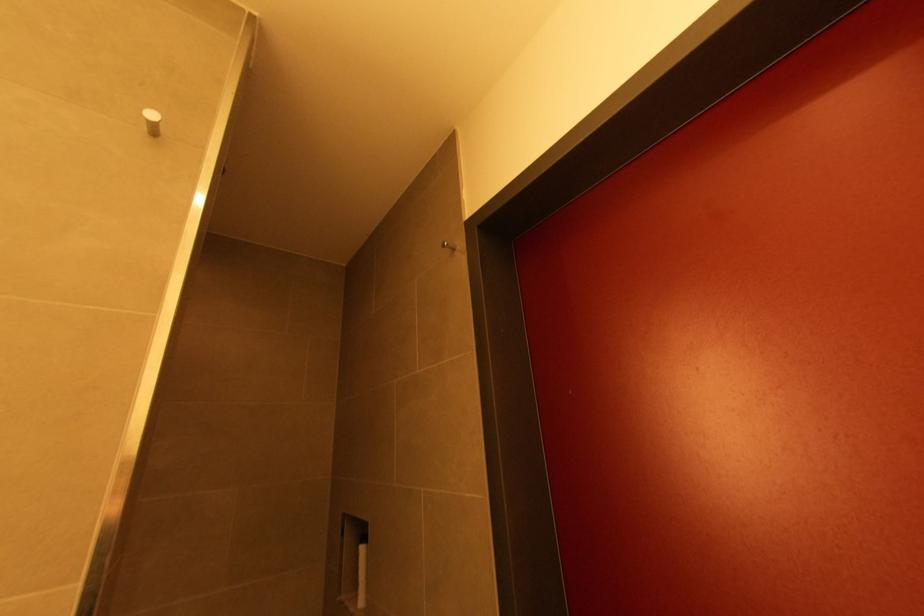
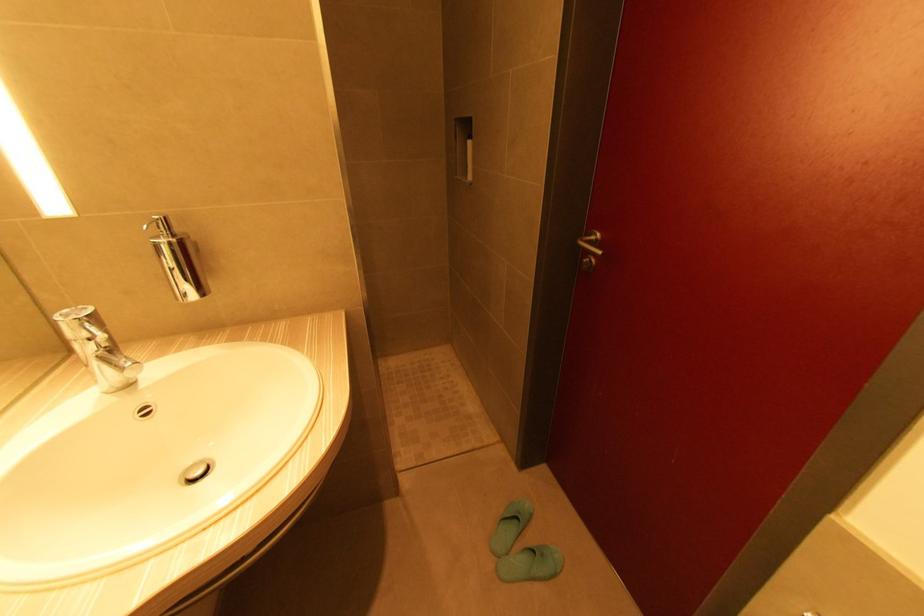
First-person continuous shooting, in which direction is the camera rotating?

The rotation direction of the camera is left-down.